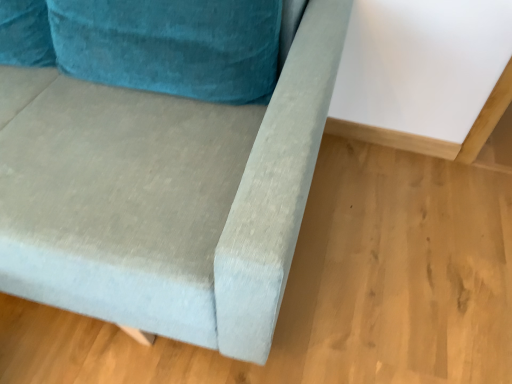
Question: Should I look upward or downward to see velvet blue couch at center?

Choices:
 (A) down
 (B) up

Answer: (B)